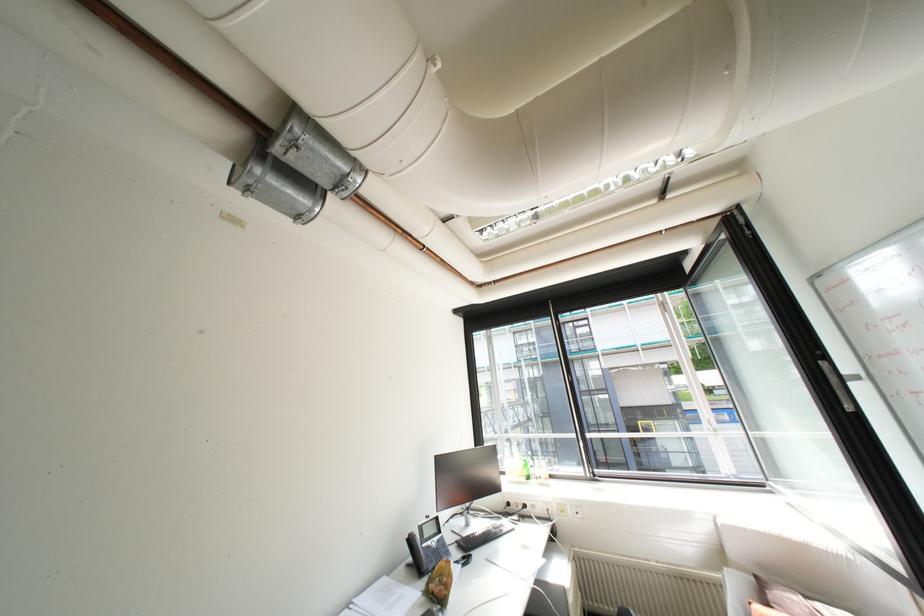
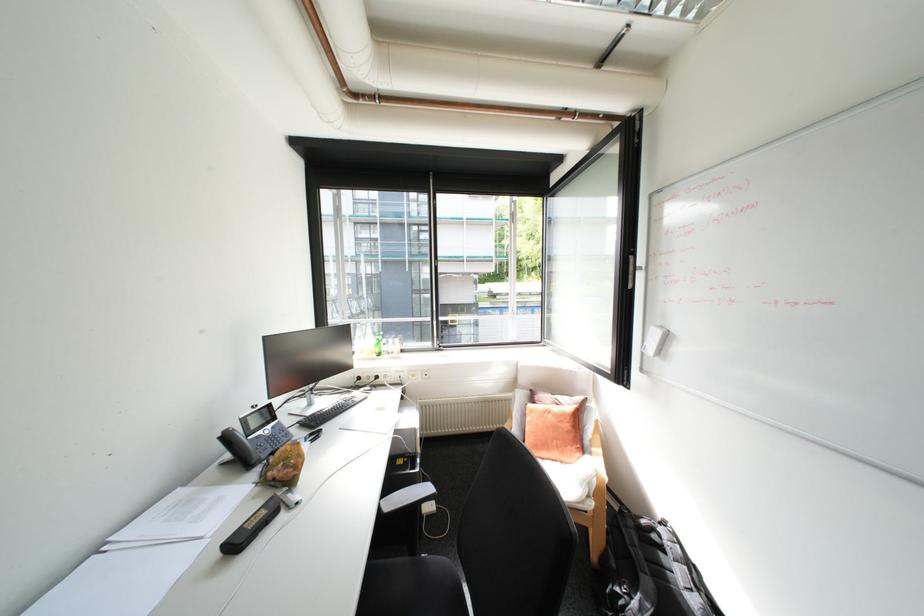
Find the pixel in the second image that matches [528,477] in the first image.

(379, 354)